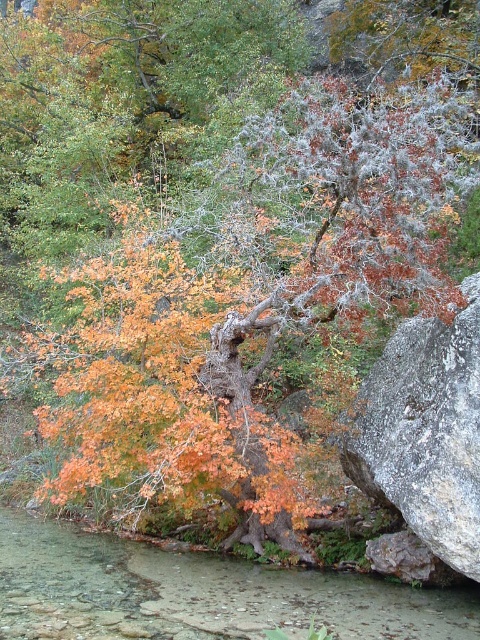
Where is `clear glass stream at lower left`? This screenshot has height=640, width=480. clear glass stream at lower left is located at coordinates (197, 593).

Is point (429, 602) positioned in front of point (407, 376)?

Yes, point (429, 602) is in front of point (407, 376).

The height and width of the screenshot is (640, 480). Describe the element at coordinates (197, 593) in the screenshot. I see `clear glass stream at lower left` at that location.

I want to click on clear glass stream at lower left, so click(x=197, y=593).